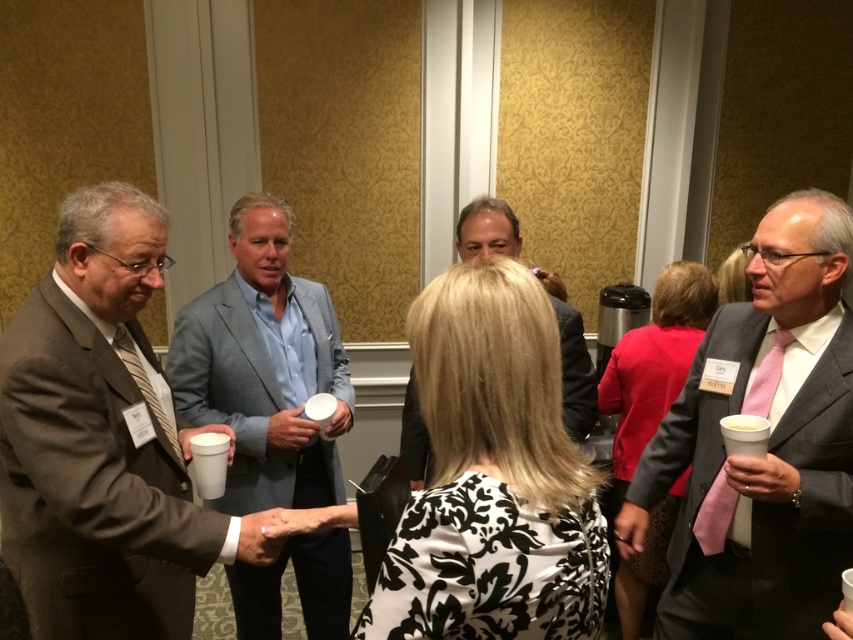
Based on the photo, you are at a networking event and want to approach the brown wool suit at left and the light blue textured blazer at center. Which one should you approach first if you want to greet the person closest to you?

You should approach the brown wool suit at left first because it is closer to the viewer than the light blue textured blazer at center.

You are a photographer at this event and need to capture a photo of both the light blue textured blazer at center and the matte gray suit at center. Which one should you focus on first if you want to ensure both are in the frame without moving the camera?

You should focus on the light blue textured blazer at center first because it is larger in size than the matte gray suit at center, so positioning it properly will help frame the smaller matte gray suit at center effectively without needing to adjust the camera angle.

You are standing at the center of the room. Which direction should you walk to reach the brown wool suit at left?

Since the brown wool suit at left is located at point (91, 484), you should walk towards the left side of the room to reach it.